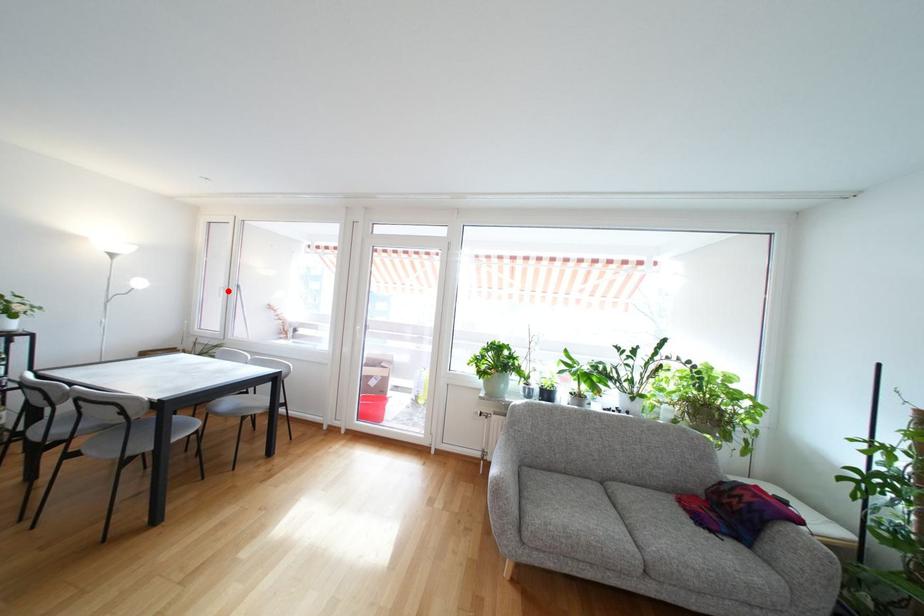
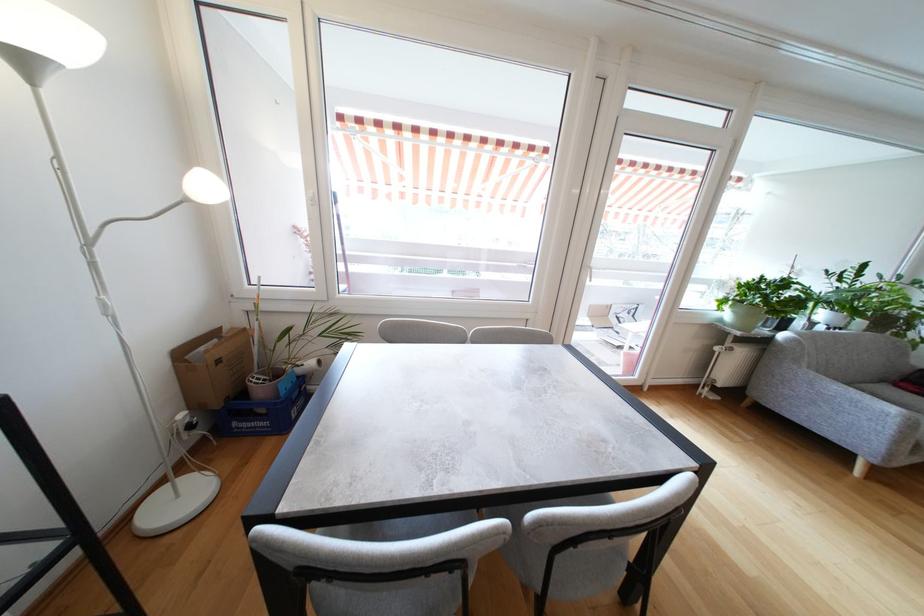
Locate, in the second image, the point that corresponds to the highlighted location in the first image.

(315, 201)